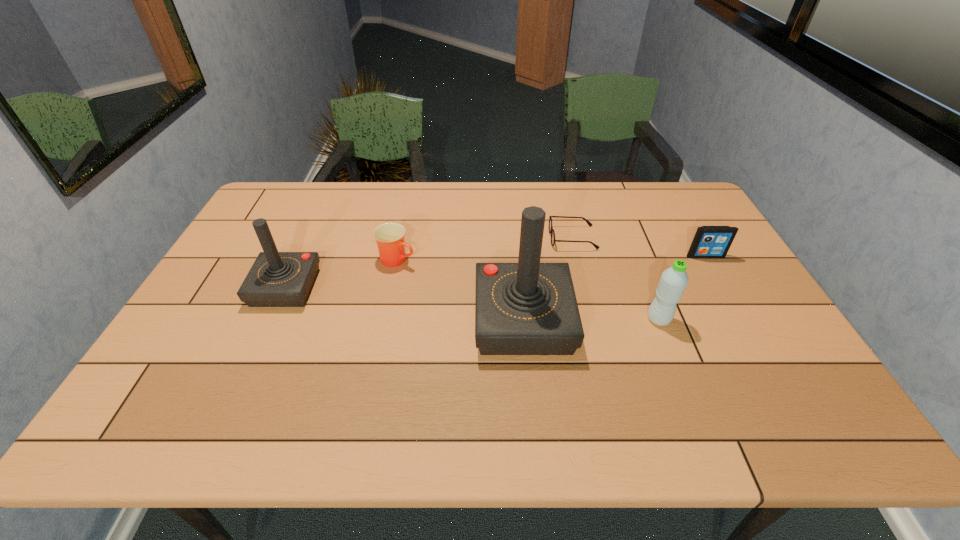
The width and height of the screenshot is (960, 540). In order to click on free region at the near edge in this screenshot , I will do `click(362, 367)`.

Locate an element on the screen. vacant region at the right edge of the desktop is located at coordinates (769, 319).

The width and height of the screenshot is (960, 540). Find the location of `free space at the far right corner of the desktop`. free space at the far right corner of the desktop is located at coordinates (658, 201).

You are a GUI agent. You are given a task and a screenshot of the screen. Output one action in this format:
    pyautogui.click(x=<x>, y=<y>)
    Task: Click on the vacant point located between the leftmost object and the taller joystick
    This screenshot has height=540, width=960.
    Given the screenshot: What is the action you would take?
    pyautogui.click(x=404, y=304)

In order to click on vacant area that lies between the rightmost object and the right joystick in this screenshot , I will do `click(614, 288)`.

This screenshot has width=960, height=540. I want to click on free spot between the fifth object from left to right and the taller joystick, so click(x=591, y=320).

Locate an element on the screen. vacant area between the fifth object from right to left and the leftmost object is located at coordinates (342, 273).

In order to click on vacant area that lies between the leftmost object and the third tallest object in this screenshot , I will do `click(472, 303)`.

At what (x,y) coordinates should I click in order to perform the action: click on free space that is in between the tallest object and the fourth shortest object. Please return your answer as a coordinate pair (x, y). This screenshot has height=540, width=960. Looking at the image, I should click on (591, 320).

The image size is (960, 540). In order to click on empty space that is in between the leftmost object and the spectacles in this screenshot , I will do `click(429, 262)`.